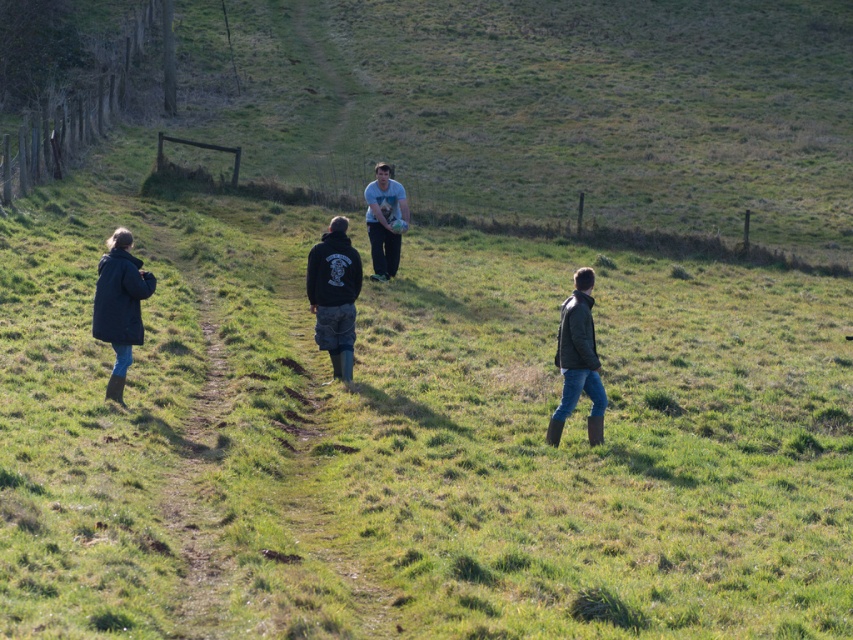
Is dark blue jacket at left thinner than white matte t-shirt at center?

Yes, dark blue jacket at left is thinner than white matte t-shirt at center.

Measure the distance between dark blue jacket at left and white matte t-shirt at center.

dark blue jacket at left and white matte t-shirt at center are 27.09 feet apart from each other.

Which is behind, point (131, 240) or point (393, 250)?

Positioned behind is point (393, 250).

Identify the location of dark blue jacket at left. The image size is (853, 640). (119, 305).

Can you confirm if black matte jacket at center is taller than leather jacket at center?

Yes, black matte jacket at center is taller than leather jacket at center.

Who is more distant from viewer, [346,224] or [582,289]?

The point [346,224] is behind.

This screenshot has height=640, width=853. What do you see at coordinates (334, 294) in the screenshot? I see `black matte jacket at center` at bounding box center [334, 294].

Find the location of `black matte jacket at center`. black matte jacket at center is located at coordinates (334, 294).

Is dark blue jacket at left shorter than leather jacket at center?

Yes, dark blue jacket at left is shorter than leather jacket at center.

Does dark blue jacket at left have a smaller size compared to leather jacket at center?

Indeed, dark blue jacket at left has a smaller size compared to leather jacket at center.

This screenshot has height=640, width=853. In order to click on dark blue jacket at left in this screenshot , I will do `click(119, 305)`.

At what (x,y) coordinates should I click in order to perform the action: click on dark blue jacket at left. Please return your answer as a coordinate pair (x, y). The image size is (853, 640). Looking at the image, I should click on (119, 305).